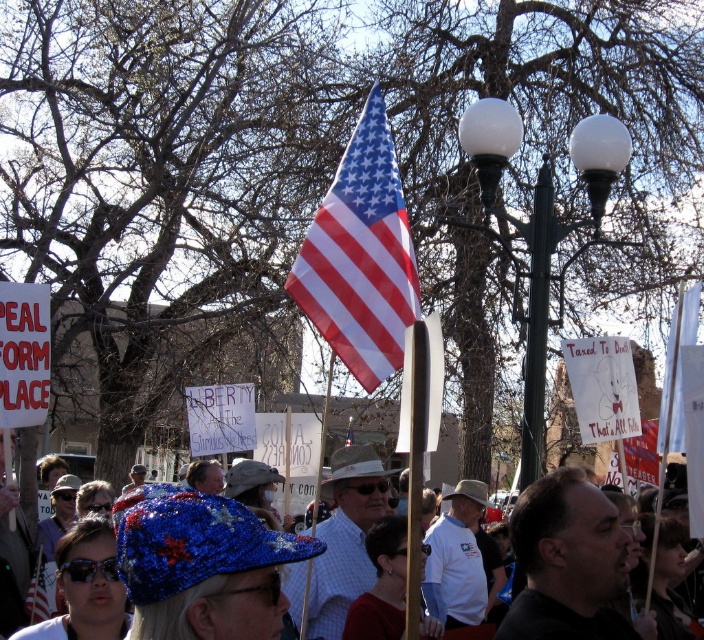
You are a photographer at the protest scene. You want to capture a photo that includes both the american flag at center and the red fabric flag at center. Based on their positions, which flag should you place on the left side of your photo to ensure both are in frame?

The american flag at center is to the left of the red fabric flag at center, so to include both in the frame, position the american flag at center on the left side of the photo.

You are a photographer trying to capture a shot of the american flag at center and the sequined fabric hat at center. Which object should you zoom in on to make them appear the same size in your photo?

The american flag at center has a lesser width compared to sequined fabric hat at center, so you should zoom in on the american flag at center to make them appear the same size in the photo.

You are a photographer at the protest scene. You want to capture a photo that includes both the american flag at center and the red fabric flag at center. Which flag should you position lower in your camera frame to ensure both are visible?

The American flag at center is above the red fabric flag at center, so to include both in the photo, you should position the red fabric flag at center lower in the frame.